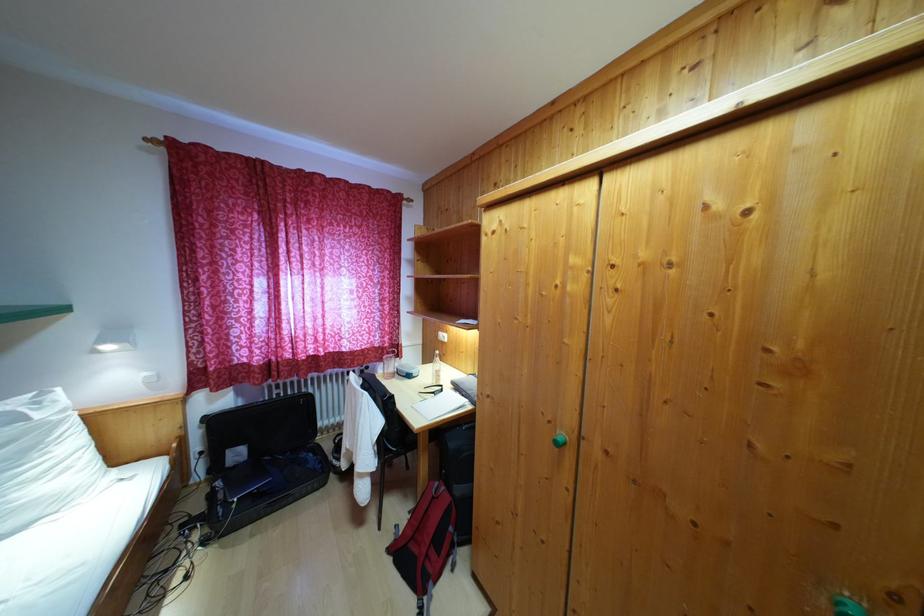
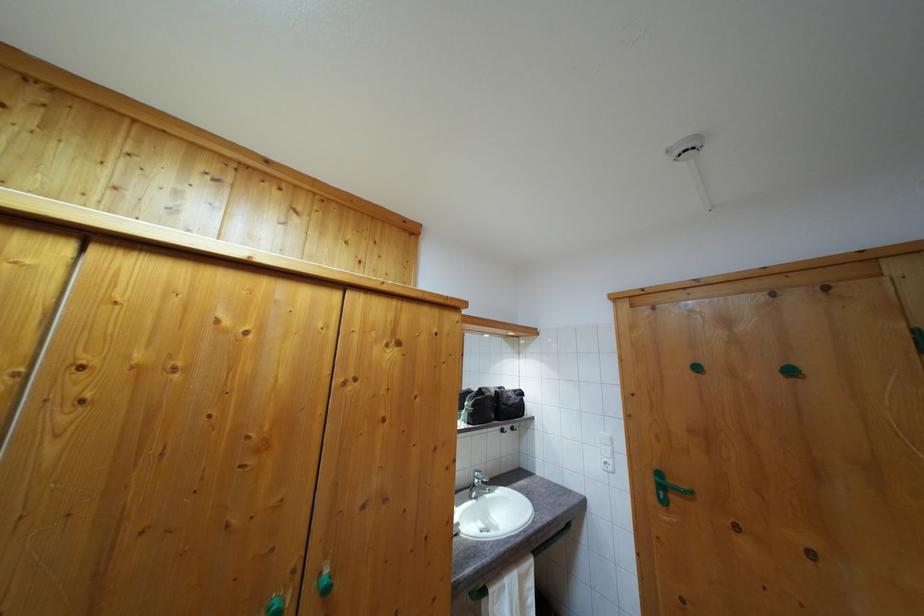
Question: The images are taken continuously from a first-person perspective. In which direction is your viewpoint rotating?

Choices:
 (A) Left
 (B) Right
 (C) Up
 (D) Down

Answer: (B)